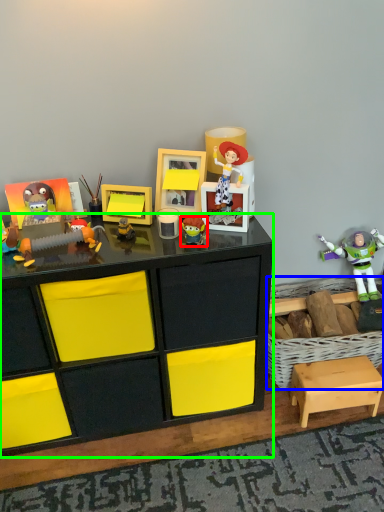
Question: Based on their relative distances, which object is nearer to toy (highlighted by a red box)? Choose from crate (highlighted by a blue box) and desk (highlighted by a green box).

Choices:
 (A) crate
 (B) desk

Answer: (B)